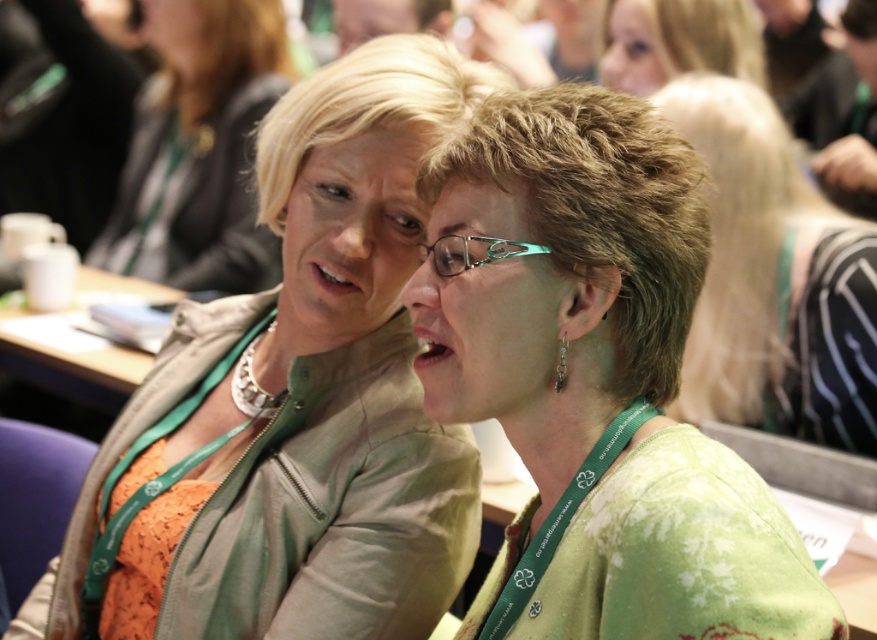
Measure the distance between matte green jacket at center and camera.

The distance of matte green jacket at center from camera is 3.66 feet.

Is matte green jacket at center taller than green fabric at center?

Indeed, matte green jacket at center has a greater height compared to green fabric at center.

Where is `matte green jacket at center`? The image size is (877, 640). matte green jacket at center is located at coordinates (291, 403).

Identify the location of matte green jacket at center. (291, 403).

Which of these two, green fabric at center or blonde hair at upper center, stands taller?

With more height is green fabric at center.

Based on the photo, is green fabric at center in front of blonde hair at upper center?

Yes, green fabric at center is closer to the viewer.

This screenshot has height=640, width=877. Identify the location of green fabric at center. (774, 280).

What do you see at coordinates (596, 376) in the screenshot? The width and height of the screenshot is (877, 640). I see `green textured blouse at center` at bounding box center [596, 376].

Between point (751, 548) and point (818, 282), which one is positioned behind?

The point (818, 282) is behind.

Identify the location of green textured blouse at center. The image size is (877, 640). (596, 376).